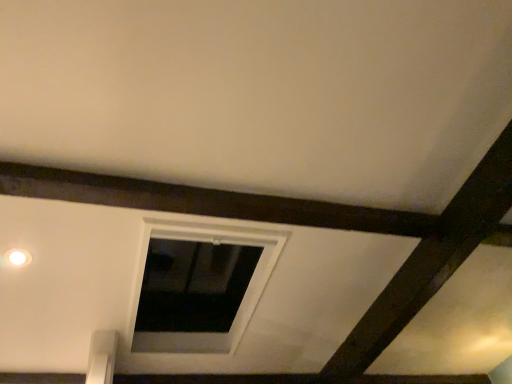
What are the coordinates of `white glossy droplight at upper left` in the screenshot? It's located at (17, 257).

Describe the element at coordinates (17, 257) in the screenshot. The width and height of the screenshot is (512, 384). I see `white glossy droplight at upper left` at that location.

At what (x,y) coordinates should I click in order to perform the action: click on white glossy droplight at upper left. Please return your answer as a coordinate pair (x, y). The height and width of the screenshot is (384, 512). Looking at the image, I should click on (17, 257).